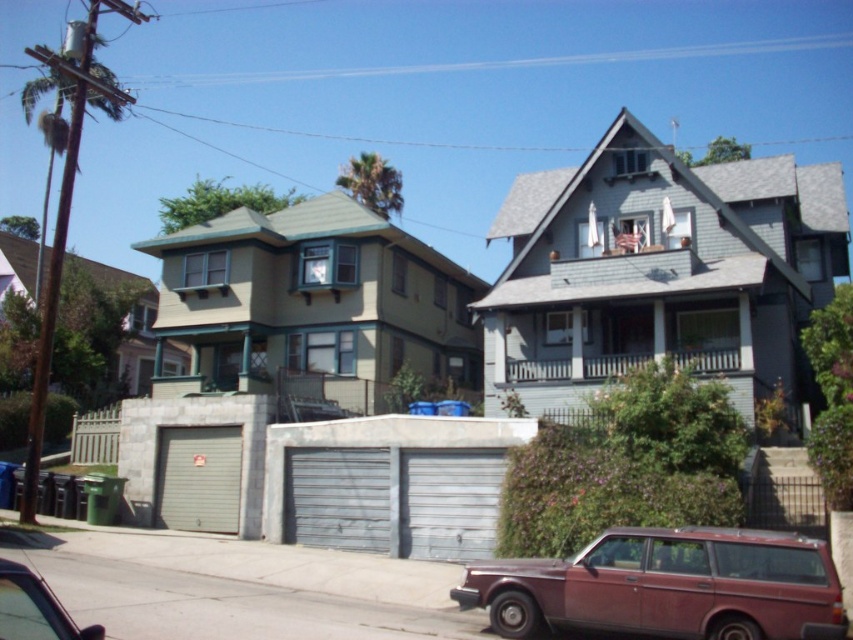
Question: Does gray wood garage at upper right have a greater width compared to metallic red car at lower left?

Choices:
 (A) no
 (B) yes

Answer: (B)

Question: Does gray wood garage at upper right appear over metallic red car at lower left?

Choices:
 (A) yes
 (B) no

Answer: (A)

Question: Is gray wood garage at upper right closer to the viewer compared to green wood garage at center?

Choices:
 (A) no
 (B) yes

Answer: (B)

Question: Considering the real-world distances, which object is closest to the green wood garage at center?

Choices:
 (A) gray wood garage at upper right
 (B) rustic maroon station wagon at lower center
 (C) metallic red car at lower left

Answer: (A)

Question: Which of these objects is positioned closest to the metallic red car at lower left?

Choices:
 (A) rustic maroon station wagon at lower center
 (B) green wood garage at center

Answer: (A)

Question: Among these points, which one is nearest to the camera?

Choices:
 (A) (59, 632)
 (B) (360, 358)

Answer: (A)